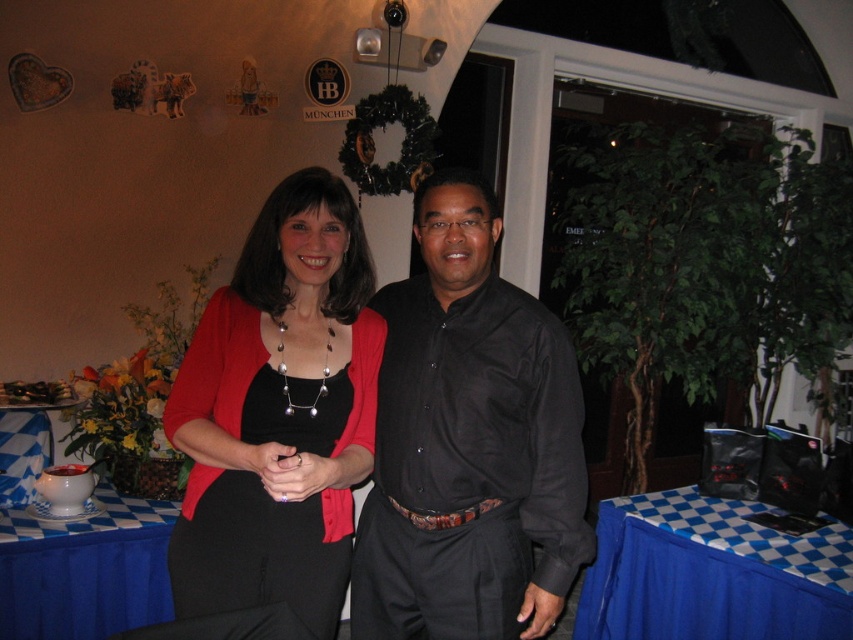
Is blue checkered tablecloth at lower right shorter than black satin dress at center?

Yes.

Measure the distance between point [843,632] and camera.

A distance of 6.66 feet exists between point [843,632] and camera.

This screenshot has height=640, width=853. Find the location of `blue checkered tablecloth at lower right`. blue checkered tablecloth at lower right is located at coordinates (711, 573).

Which of these two, blue checkered tablecloth at lower right or white ceramic bowl at lower left, stands taller?

blue checkered tablecloth at lower right

Is blue checkered tablecloth at lower right shorter than white ceramic bowl at lower left?

No.

Image resolution: width=853 pixels, height=640 pixels. Describe the element at coordinates (711, 573) in the screenshot. I see `blue checkered tablecloth at lower right` at that location.

The height and width of the screenshot is (640, 853). I want to click on blue checkered tablecloth at lower right, so click(711, 573).

Is point (276, 536) positioned in front of point (131, 624)?

Yes, it is in front of point (131, 624).

Which is in front, point (166, 413) or point (86, 609)?

Positioned in front is point (166, 413).

Describe the element at coordinates (277, 413) in the screenshot. This screenshot has height=640, width=853. I see `matte black dress at center` at that location.

Locate an element on the screen. matte black dress at center is located at coordinates (277, 413).